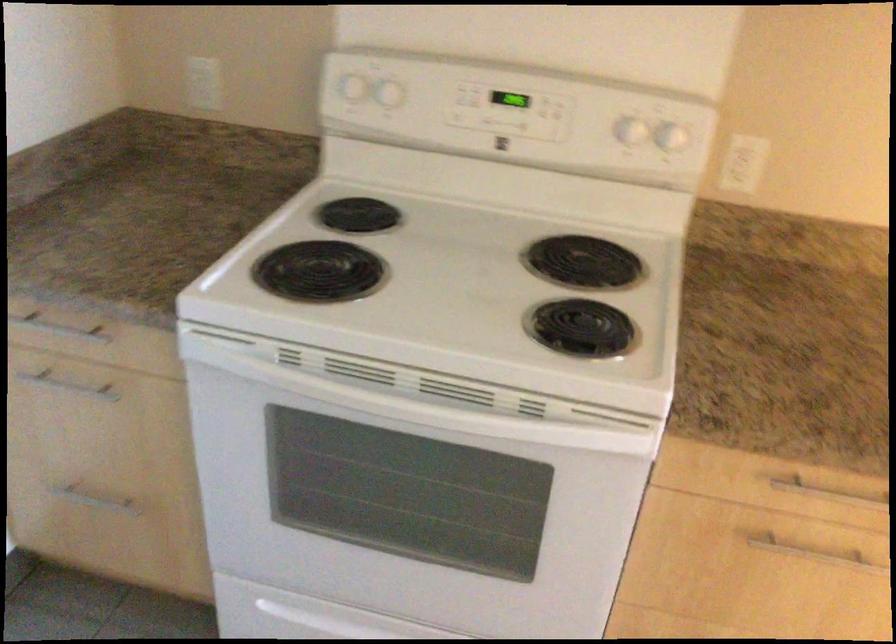
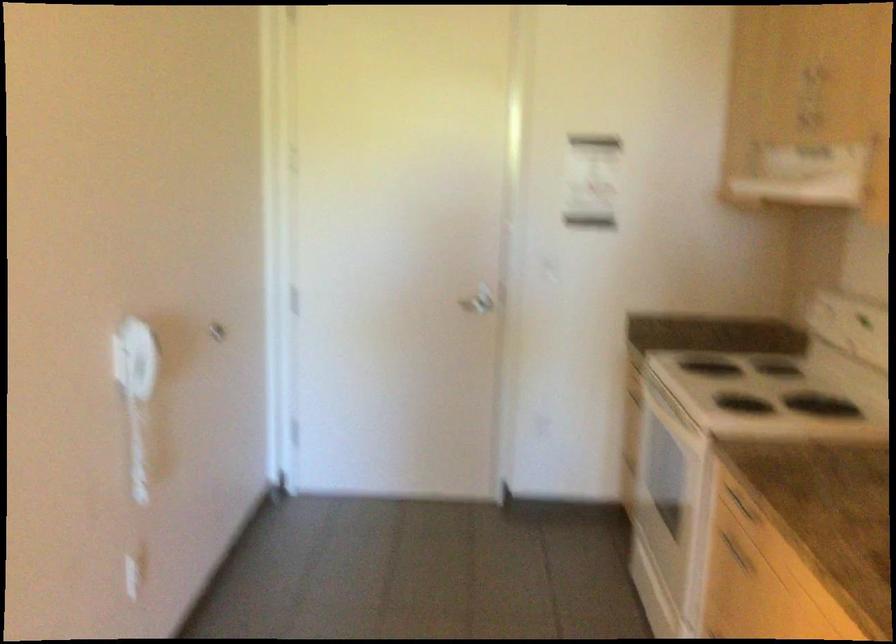
Locate, in the second image, the point that corresponds to point 763,545 in the first image.

(735, 552)